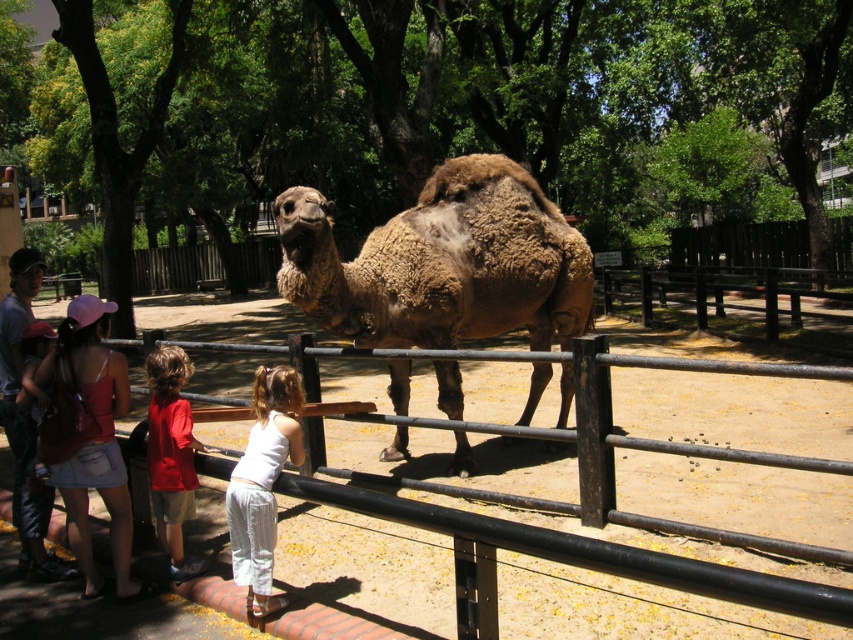
You are a zoo visitor wearing a denim skirt at lower left and a red cotton shirt at center. You want to take a photo of the camel without anyone blocking your view. Which clothing item should you move to get a clear shot?

The red cotton shirt at center is behind the denim skirt at lower left. To get a clear shot of the camel, move the denim skirt at lower left out of the way since the red cotton shirt at center is already positioned behind it and might still be blocked.

You are a photographer standing at the camera position. You want to take a photo of the fuzzy brown camel at center but need to ensure you are within the 15 feet safety zone required by the zoo for animals. Are you within the safe distance?

The fuzzy brown camel at center is 15.41 feet away from the camera. Since the required safety zone is 15 feet, you are slightly beyond the safe distance and should move closer to ensure compliance.

You are a zookeeper who needs to ensure the red cotton shirt at center and the fuzzy brown camel at center are visible to visitors through a new viewing window. The window can only accommodate one object at a time. Which object should be prioritized to fit within the window based on their sizes?

The fuzzy brown camel at center is wider than the red cotton shirt at center, so the window should prioritize displaying the fuzzy brown camel at center to ensure it fits properly.